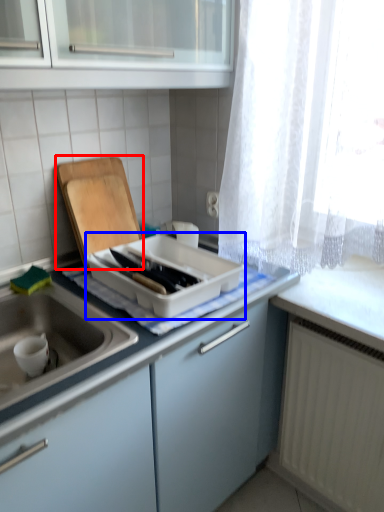
Question: Among these objects, which one is nearest to the camera, cutting board (highlighted by a red box) or kitchen appliance (highlighted by a blue box)?

Choices:
 (A) cutting board
 (B) kitchen appliance

Answer: (B)